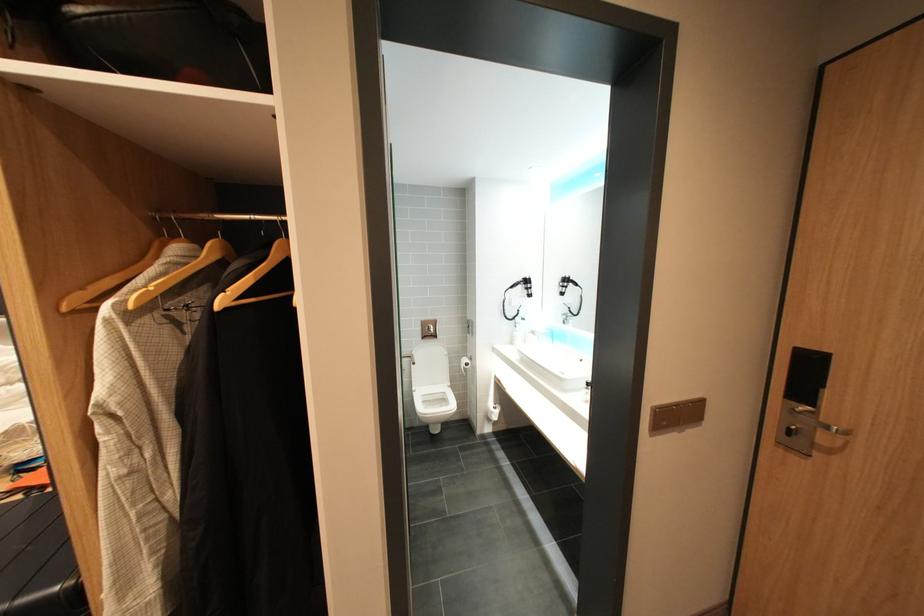
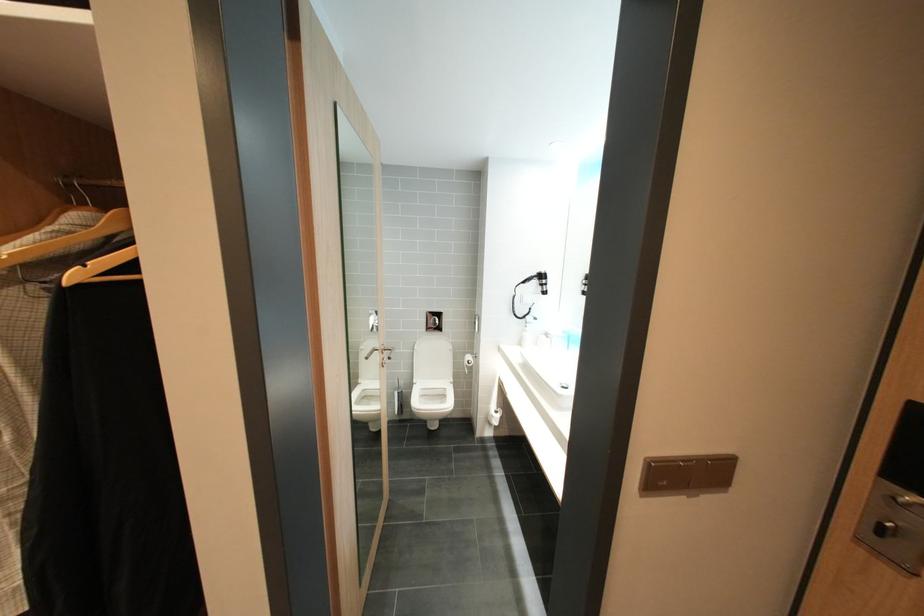
In the second image, find the point that corresponds to the point at 430,330 in the first image.

(434, 321)